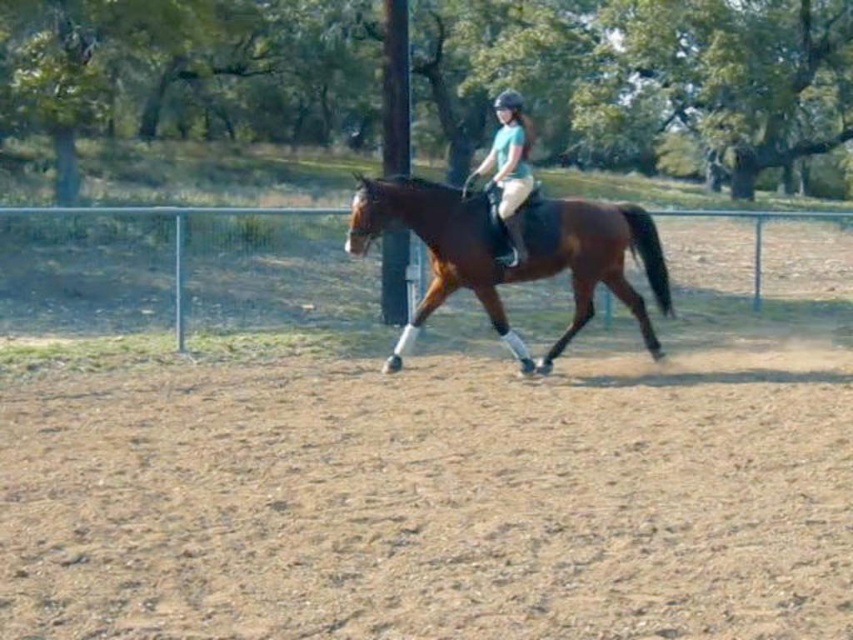
Question: Which is nearer to the brown sandy ground at lower center?

Choices:
 (A) matte green shirt at center
 (B) green wire fence at center
 (C) brown glossy horse at center

Answer: (C)

Question: Which of the following is the farthest from the observer?

Choices:
 (A) brown glossy horse at center
 (B) matte green shirt at center
 (C) green wire fence at center

Answer: (C)

Question: Estimate the real-world distances between objects in this image. Which object is closer to the brown sandy ground at lower center?

Choices:
 (A) green wire fence at center
 (B) matte green shirt at center

Answer: (B)

Question: Is brown sandy ground at lower center closer to camera compared to brown glossy horse at center?

Choices:
 (A) no
 (B) yes

Answer: (B)

Question: Is brown glossy horse at center further to the viewer compared to green wire fence at center?

Choices:
 (A) yes
 (B) no

Answer: (B)

Question: Can you confirm if brown sandy ground at lower center is positioned to the left of brown glossy horse at center?

Choices:
 (A) yes
 (B) no

Answer: (B)